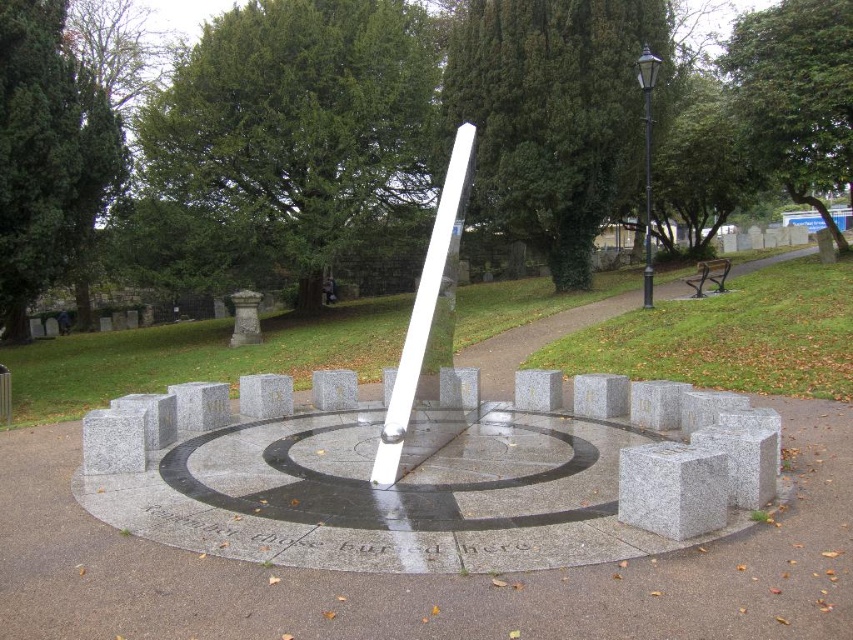
Who is more distant from viewer, (717, 486) or (427, 250)?

The point (427, 250) is more distant.

Find the location of a particular element. The width and height of the screenshot is (853, 640). gray granite cube at lower right is located at coordinates (672, 490).